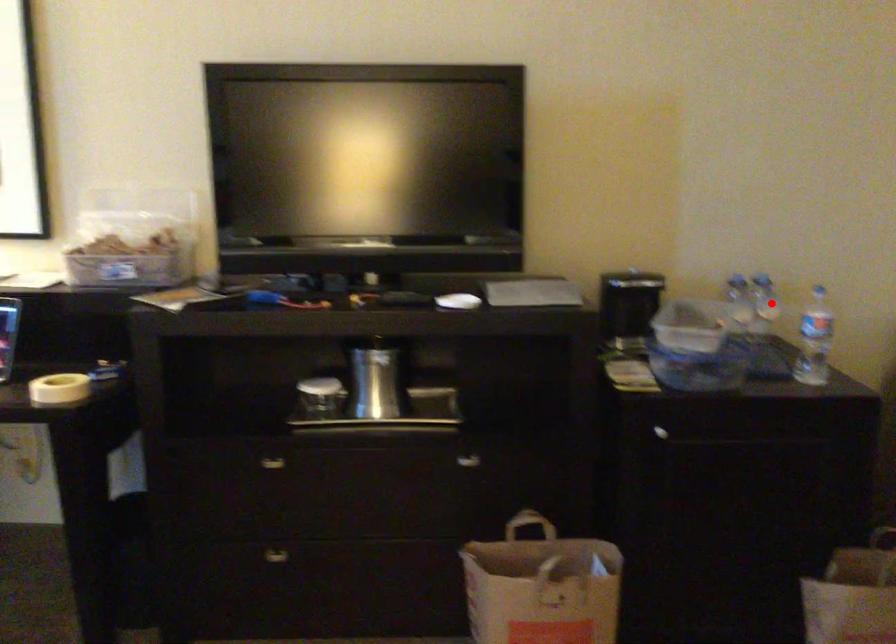
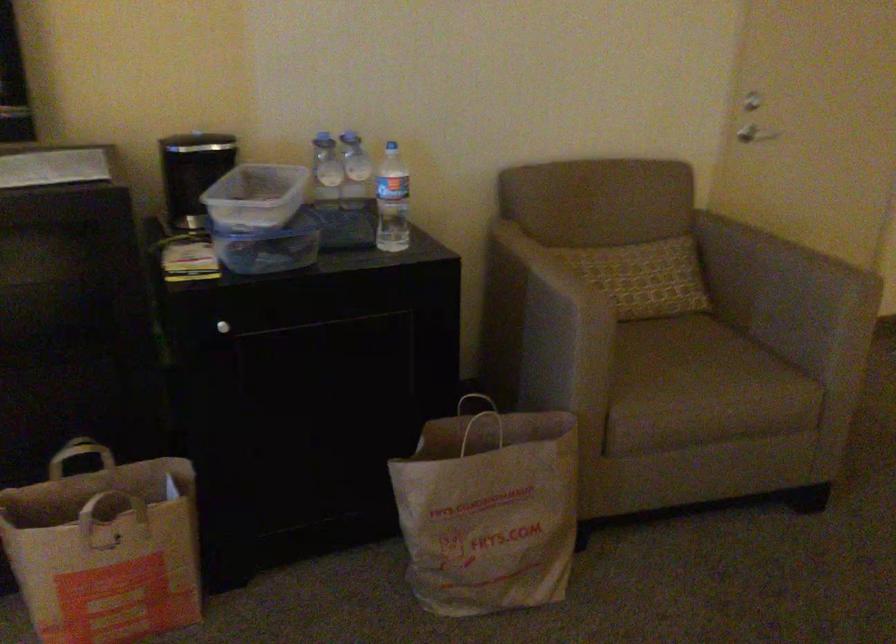
In the second image, find the point that corresponds to the highlighted location in the first image.

(355, 171)